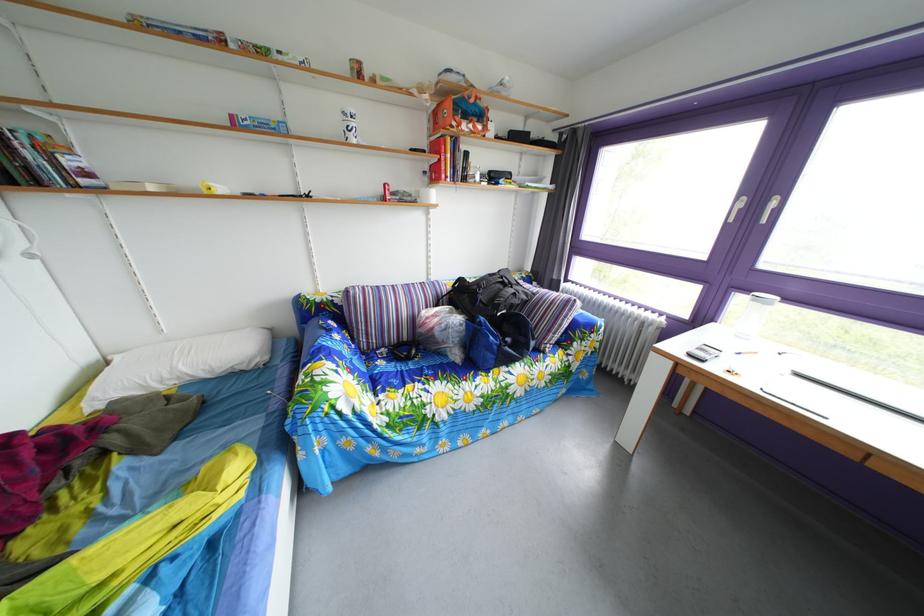
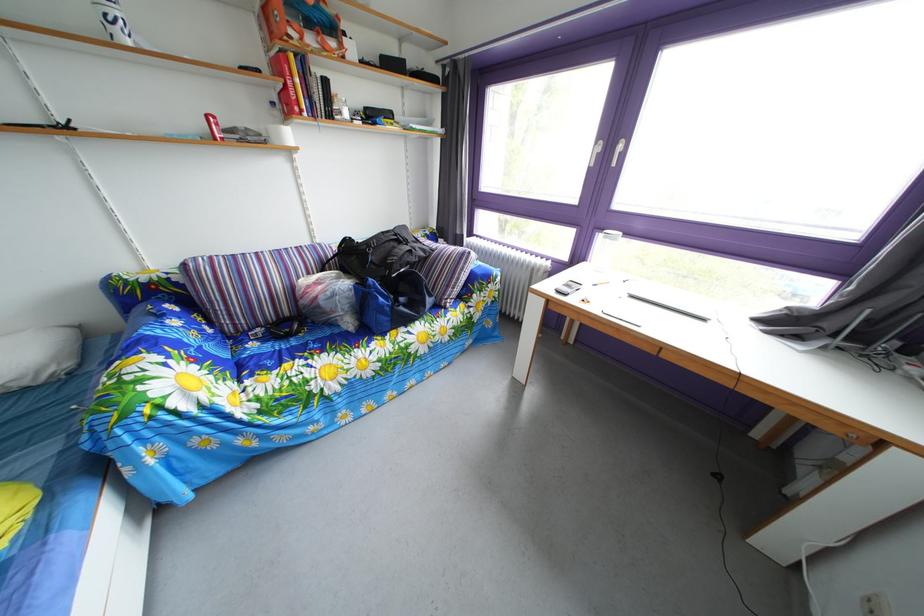
The point at [391,371] is marked in the first image. Where is the corresponding point in the second image?

(262, 353)